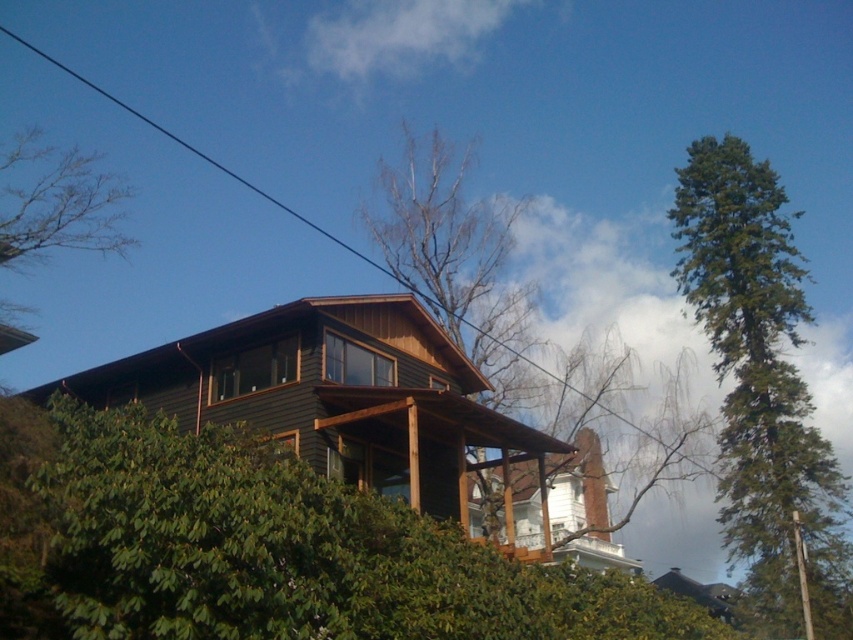
Can you confirm if green textured tree at right is wider than bare wood tree at center?

Yes.

Who is taller, green textured tree at right or bare wood tree at center?

green textured tree at right is taller.

Which is behind, point (793, 588) or point (508, 218)?

Point (508, 218)

Where is `green textured tree at right`? The image size is (853, 640). green textured tree at right is located at coordinates (761, 385).

Does green matte tree at lower left appear under green textured tree at right?

Correct, green matte tree at lower left is located below green textured tree at right.

Looking at this image, which is below, green matte tree at lower left or green textured tree at right?

green matte tree at lower left

The width and height of the screenshot is (853, 640). Identify the location of green matte tree at lower left. (293, 552).

Which is below, green matte tree at lower left or bare wood tree at center?

green matte tree at lower left is lower down.

Between green matte tree at lower left and bare wood tree at center, which one appears on the left side from the viewer's perspective?

green matte tree at lower left is more to the left.

This screenshot has height=640, width=853. I want to click on green matte tree at lower left, so click(293, 552).

Locate an element on the screen. This screenshot has width=853, height=640. green matte tree at lower left is located at coordinates (293, 552).